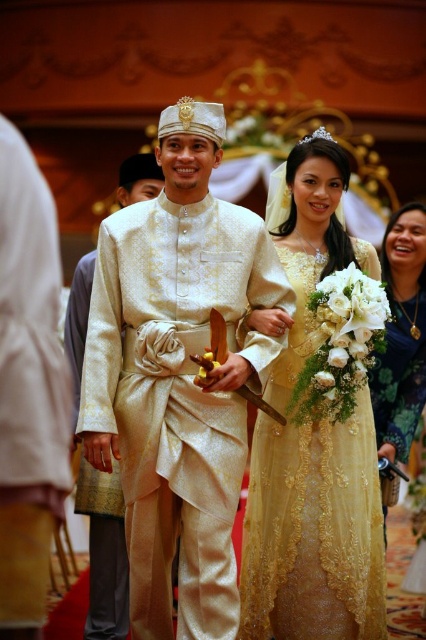
Which is below, ivory silk robe at center or silky cream robe at center?

ivory silk robe at center is below.

Which is above, ivory silk robe at center or silky cream robe at center?

silky cream robe at center

Find the location of a particular element. This screenshot has width=426, height=640. ivory silk robe at center is located at coordinates (175, 397).

What do you see at coordinates (313, 531) in the screenshot? The image size is (426, 640). I see `golden lace dress at center` at bounding box center [313, 531].

Between point (319, 625) and point (123, 589), which one is positioned in front?

Point (319, 625)

The image size is (426, 640). I want to click on golden lace dress at center, so click(313, 531).

Who is positioned more to the right, golden lace dress at center or matte gold dress at lower right?

matte gold dress at lower right

Identify the location of golden lace dress at center. This screenshot has width=426, height=640. (313, 531).

Locate an element on the screen. This screenshot has width=426, height=640. golden lace dress at center is located at coordinates (313, 531).